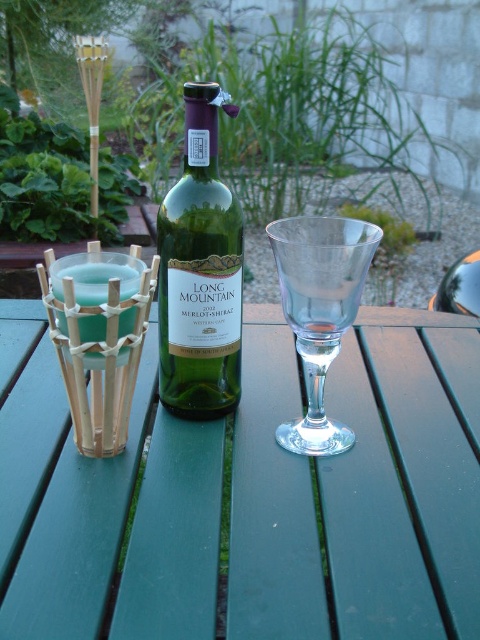
The height and width of the screenshot is (640, 480). Describe the element at coordinates (200, 272) in the screenshot. I see `green glass bottle at center` at that location.

Image resolution: width=480 pixels, height=640 pixels. I want to click on green glass bottle at center, so click(x=200, y=272).

In the scene shown: Is green painted wood picnic table at center above transparent glass wine glass at center?

Actually, green painted wood picnic table at center is below transparent glass wine glass at center.

Measure the distance between point (314, 573) and camera.

Point (314, 573) and camera are 8.03 inches apart.

What do you see at coordinates (398, 484) in the screenshot?
I see `green painted wood picnic table at center` at bounding box center [398, 484].

The image size is (480, 640). Find the location of `green painted wood picnic table at center`. green painted wood picnic table at center is located at coordinates (398, 484).

Who is more forward, [84,609] or [196,294]?

Point [84,609] is more forward.

Which is more to the right, green painted wood picnic table at center or green glass bottle at center?

From the viewer's perspective, green glass bottle at center appears more on the right side.

What do you see at coordinates (398, 484) in the screenshot? I see `green painted wood picnic table at center` at bounding box center [398, 484].

The image size is (480, 640). What are the coordinates of `green painted wood picnic table at center` in the screenshot? It's located at (398, 484).